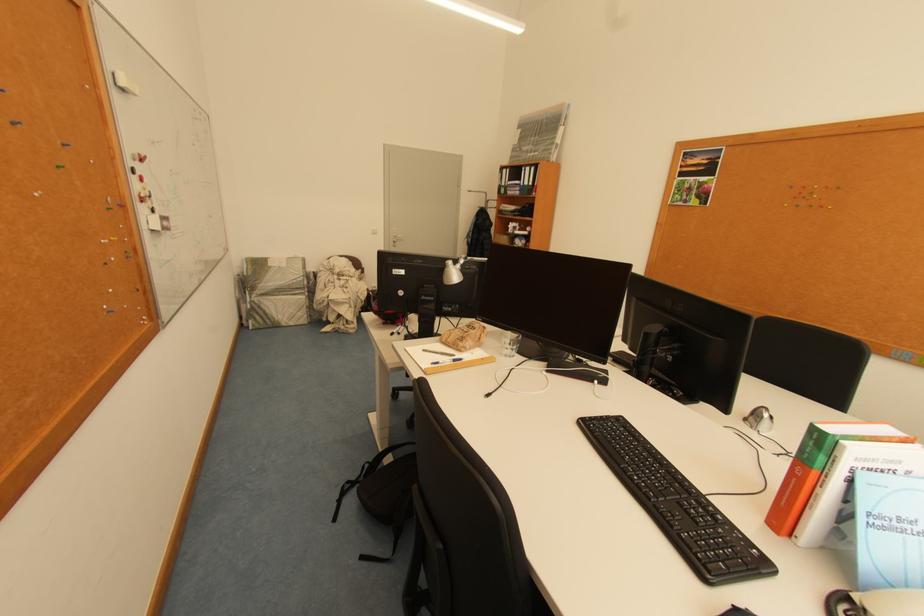
Where is `grey door handle`? The image size is (924, 616). grey door handle is located at coordinates (396, 238).